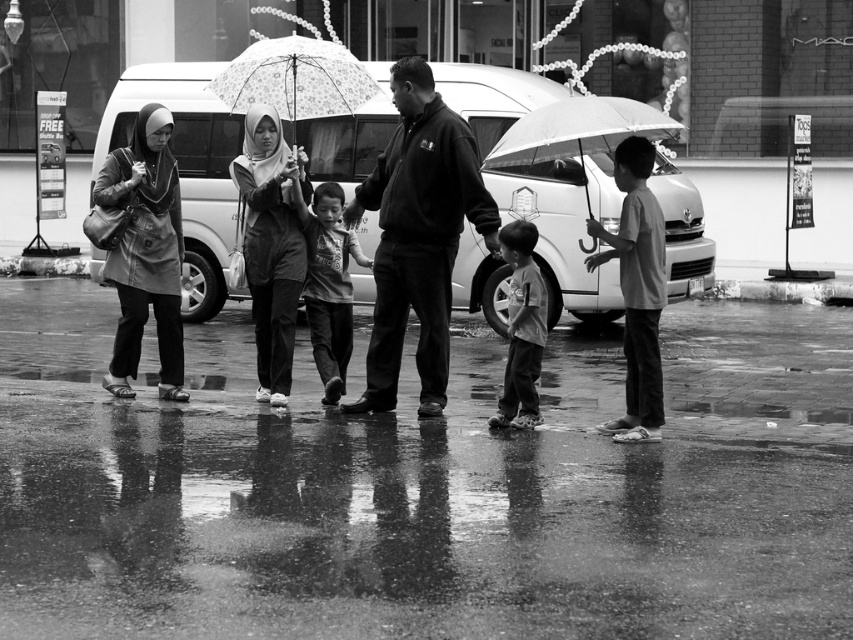
You are a photographer trying to capture a clear shot of the light gray cotton shirt at center and the transparent plastic umbrella at center. Since the umbrella is transparent, you want to ensure the shirt is not obscured by it. Based on their positions, can you position yourself so that the umbrella doesn not block the view of the shirt?

The light gray cotton shirt at center is positioned on the left side of the transparent plastic umbrella at center. Since the umbrella is transparent, you can position yourself to the right side of the umbrella to avoid it blocking the view of the shirt.

You are standing in front of the white van and want to walk towards the two points marked in the image. Which point, point (518, 81) or point (231, 68), will you reach first?

You will reach point (518, 81) first because it is closer to you than point (231, 68), which is further away.